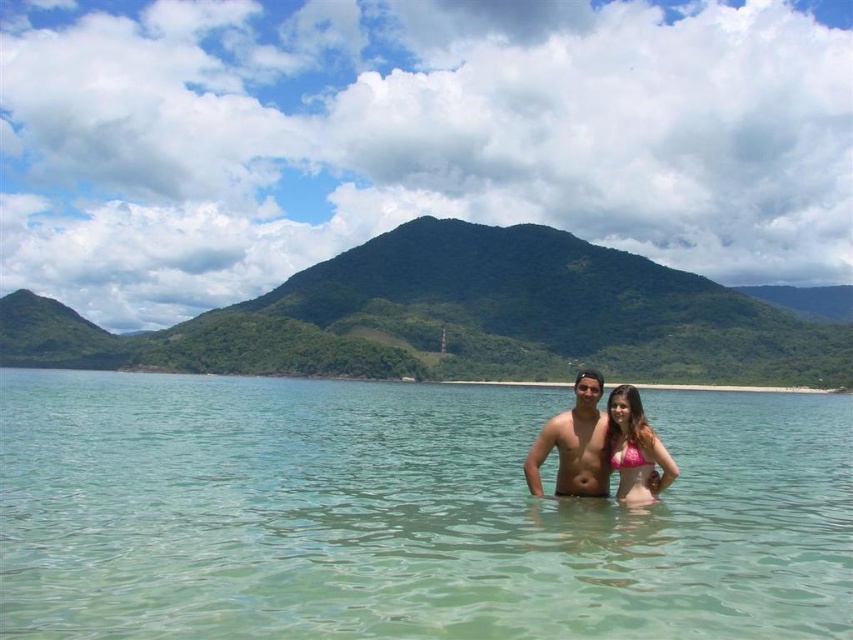
Question: Does matte skin torso at center appear on the right side of pink fabric bikini at center?

Choices:
 (A) no
 (B) yes

Answer: (B)

Question: Estimate the real-world distances between objects in this image. Which object is closer to the pink bikini at center?

Choices:
 (A) clear water at center
 (B) pink fabric bikini at center
 (C) matte skin torso at center

Answer: (B)

Question: Which object appears closest to the camera in this image?

Choices:
 (A) clear water at center
 (B) pink fabric bikini at center

Answer: (A)

Question: Is clear water at center closer to the viewer compared to pink bikini at center?

Choices:
 (A) no
 (B) yes

Answer: (B)

Question: Considering the relative positions of clear water at center and matte skin torso at center in the image provided, where is clear water at center located with respect to matte skin torso at center?

Choices:
 (A) left
 (B) right

Answer: (A)

Question: Which point appears farthest from the camera in this image?

Choices:
 (A) (625, 464)
 (B) (390, 438)
 (C) (598, 492)
 (D) (635, 451)

Answer: (B)